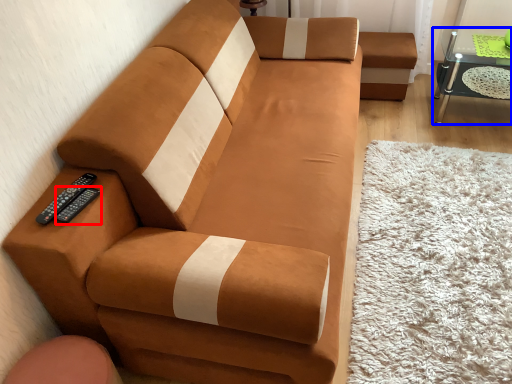
Question: Among these objects, which one is farthest to the camera, remote (highlighted by a red box) or table (highlighted by a blue box)?

Choices:
 (A) remote
 (B) table

Answer: (B)